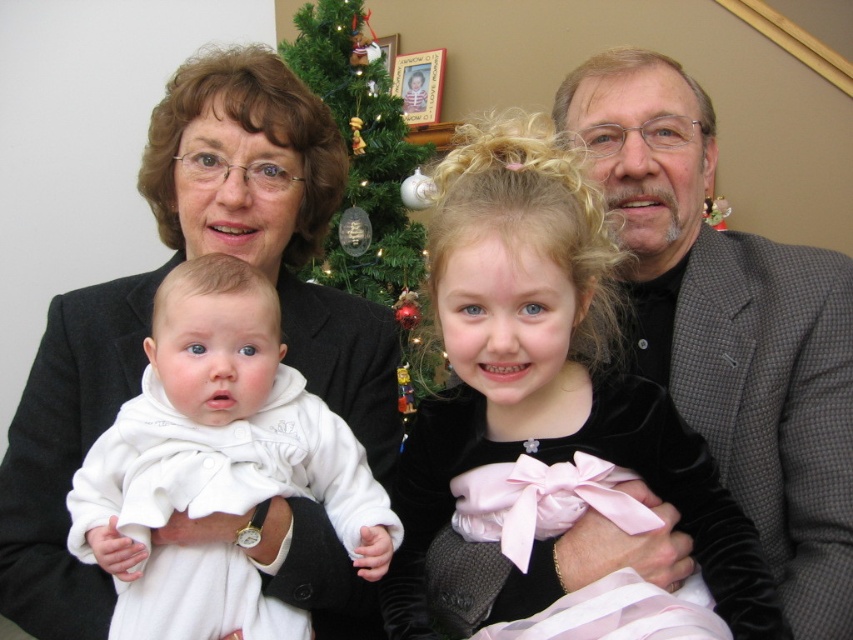
Question: Can you confirm if velvet black dress at center is positioned to the left of green matte christmas tree at center?

Choices:
 (A) yes
 (B) no

Answer: (B)

Question: Is velvet black dress at center closer to the viewer compared to green matte christmas tree at center?

Choices:
 (A) yes
 (B) no

Answer: (A)

Question: Which point is closer to the camera?

Choices:
 (A) (405, 124)
 (B) (798, 579)

Answer: (B)

Question: Which of the following is the farthest from the observer?

Choices:
 (A) white satin baby at center
 (B) green matte christmas tree at center
 (C) velvet black dress at center

Answer: (B)

Question: Based on their relative distances, which object is nearer to the white satin baby at center?

Choices:
 (A) green matte christmas tree at center
 (B) velvet black dress at center
 (C) gray textured suit at right

Answer: (B)

Question: Is the position of gray textured suit at right less distant than that of velvet black dress at center?

Choices:
 (A) yes
 (B) no

Answer: (B)